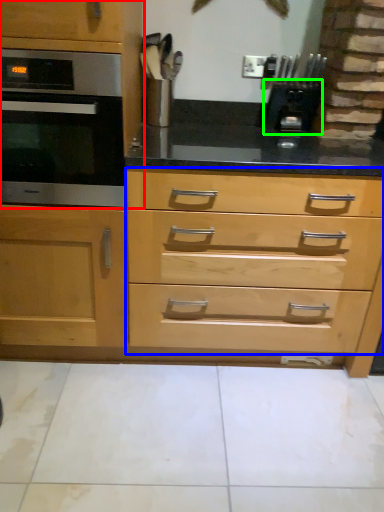
Question: Which is nearer to the cabinetry (highlighted by a red box)? drawer (highlighted by a blue box) or appliance (highlighted by a green box).

Choices:
 (A) drawer
 (B) appliance

Answer: (A)